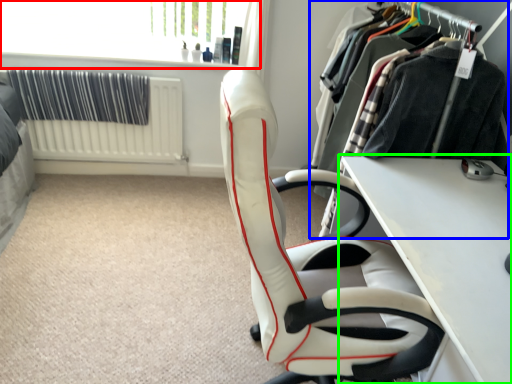
Question: Which is farther away from window screen (highlighted by a red box)? closet (highlighted by a blue box) or table (highlighted by a green box)?

Choices:
 (A) closet
 (B) table

Answer: (B)